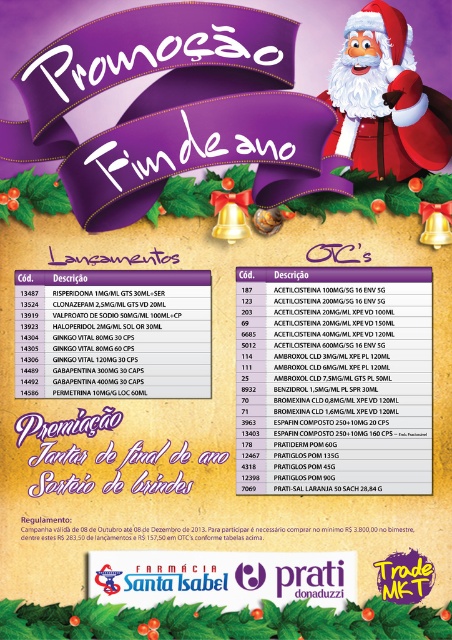
What is the exact position of the matte black text at center in the image?

The matte black text at center is located at point coordinates of (334, 380).

Based on the scene description, where is the white plush santa at upper right located in terms of coordinates?

The white plush santa at upper right is located at coordinates point (x=382, y=99).